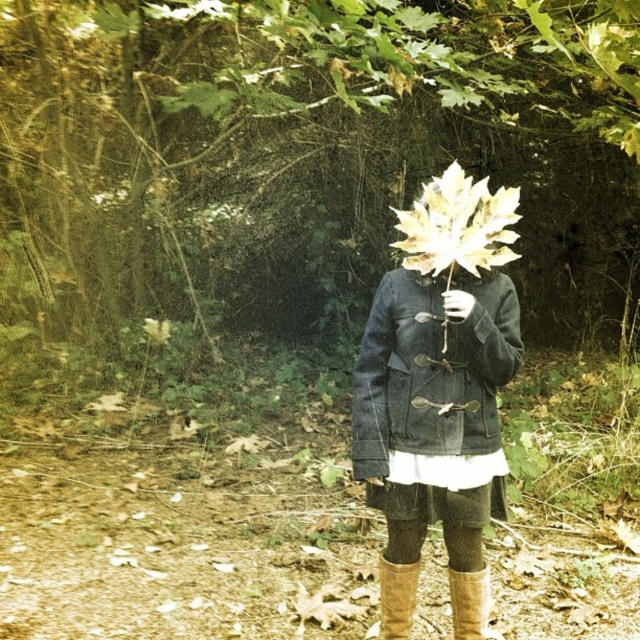
Is green leafy tree at center smaller than leather boots at lower center?

Yes.

Does green leafy tree at center appear on the left side of leather boots at lower center?

No, green leafy tree at center is not to the left of leather boots at lower center.

Is point (177, 48) closer to camera compared to point (381, 637)?

No.

This screenshot has width=640, height=640. In order to click on green leafy tree at center in this screenshot , I will do `click(308, 154)`.

Can you confirm if matte gray coat at center is smaller than brown suede boot at lower center?

Incorrect, matte gray coat at center is not smaller in size than brown suede boot at lower center.

Find the location of `matte gray coat at center`. matte gray coat at center is located at coordinates pos(440,372).

Does green leafy tree at center have a lesser width compared to brown suede boot at lower center?

Yes, green leafy tree at center is thinner than brown suede boot at lower center.

What do you see at coordinates (308, 154) in the screenshot? I see `green leafy tree at center` at bounding box center [308, 154].

Does point (131, 84) lie in front of point (464, 588)?

No, it is not.

This screenshot has height=640, width=640. What are the coordinates of `green leafy tree at center` in the screenshot? It's located at coord(308,154).